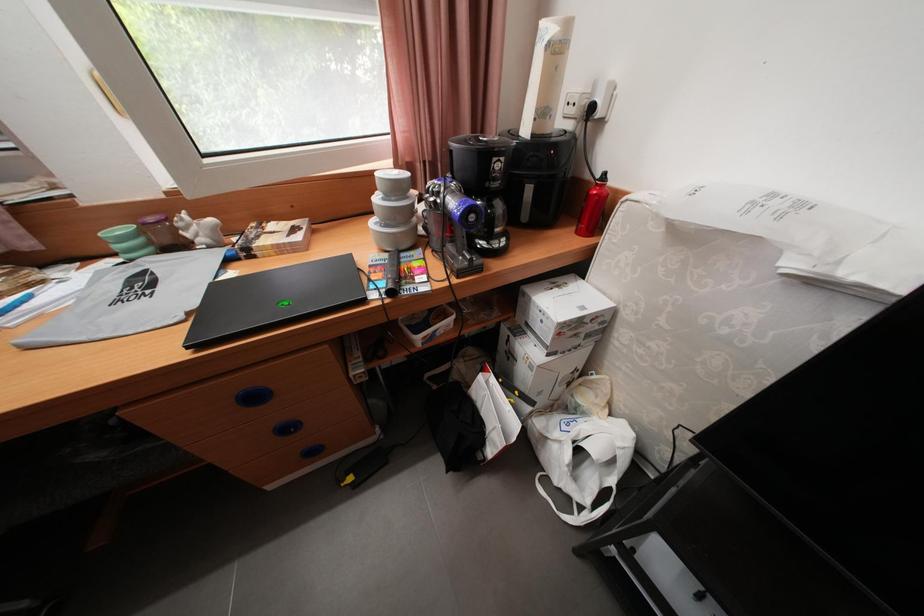
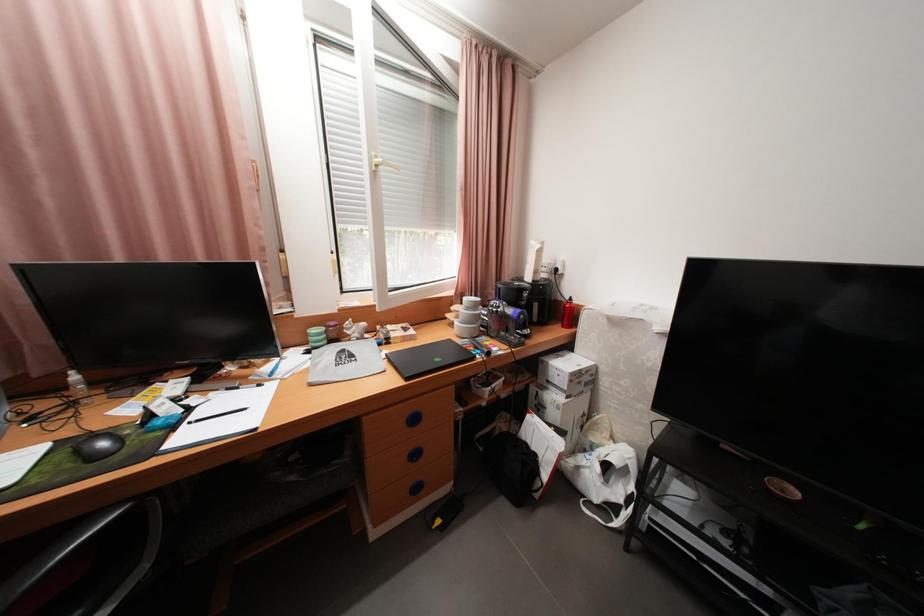
The images are taken continuously from a first-person perspective. In which direction are you moving?

The movement direction of the cameraman is left, backward.